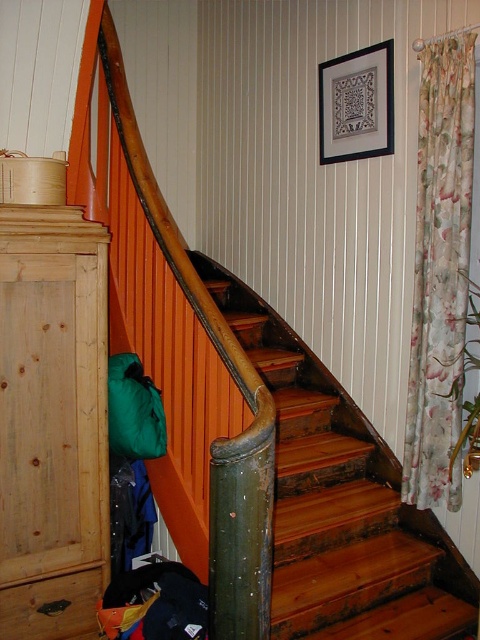
Question: Does wooden stairs at center come behind green fabric sleeping bag at lower left?

Choices:
 (A) yes
 (B) no

Answer: (B)

Question: Which point is farther to the camera?

Choices:
 (A) (144, 417)
 (B) (422, 280)
 (C) (313, 522)

Answer: (B)

Question: Which point is closer to the camera?

Choices:
 (A) green fabric sleeping bag at lower left
 (B) wooden stairs at center
 (C) floral fabric curtain at right

Answer: (B)

Question: Which of the following is the farthest from the observer?

Choices:
 (A) (326, 596)
 (B) (145, 403)

Answer: (B)

Question: Is the position of floral fabric curtain at right more distant than that of green fabric sleeping bag at lower left?

Choices:
 (A) no
 (B) yes

Answer: (B)

Question: Is wooden stairs at center bigger than floral fabric curtain at right?

Choices:
 (A) yes
 (B) no

Answer: (A)